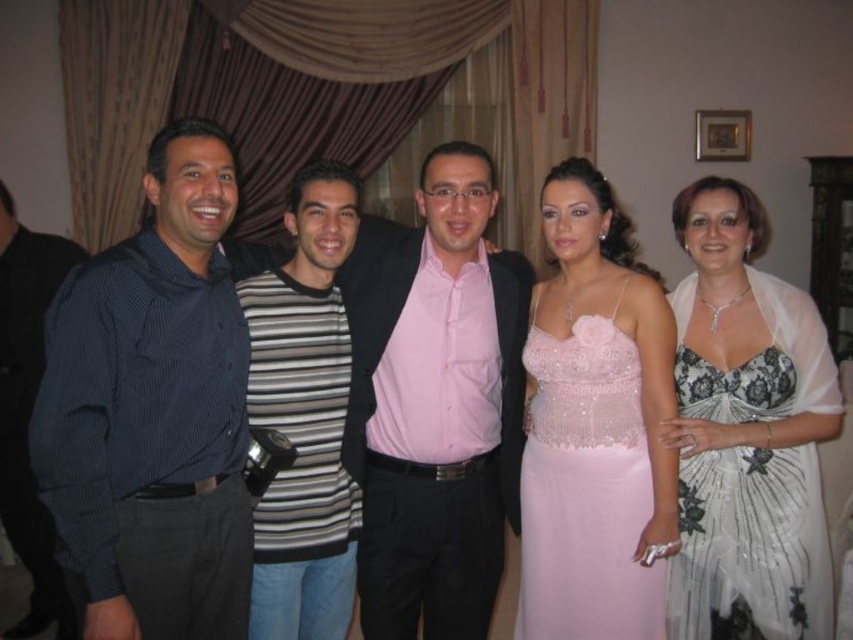
You are standing at the origin point in the room and want to move towards the point at coordinates point (387, 464). However, there is an obstacle at point (769, 358). Will you encounter this obstacle before reaching your destination?

Since point (387, 464) is behind point (769, 358), you will encounter the obstacle at point (769, 358) before reaching your destination.

You are standing in the room where the image was taken. If you face the heavy maroon curtains with tassels, which direction should you turn to look at the dark blue striped shirt at left?

Since the dark blue striped shirt at left is located at point 0.644 on the x and 0.181 on the y coordinates, you should turn to your left to face the dark blue striped shirt at left when facing the heavy maroon curtains with tassels.

You are organizing a photo shoot and need to arrange two outfits side by side. The outfits are the dark blue striped shirt at left and the white lace dress at right. Based on the image, which outfit takes up more horizontal space?

The white lace dress at right takes up more horizontal space because it has a greater width compared to the dark blue striped shirt at left.